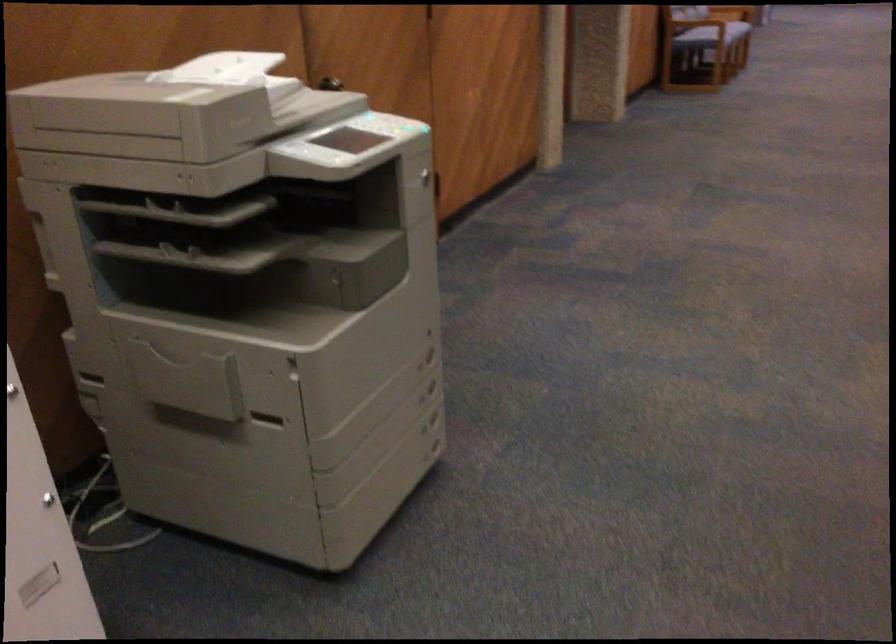
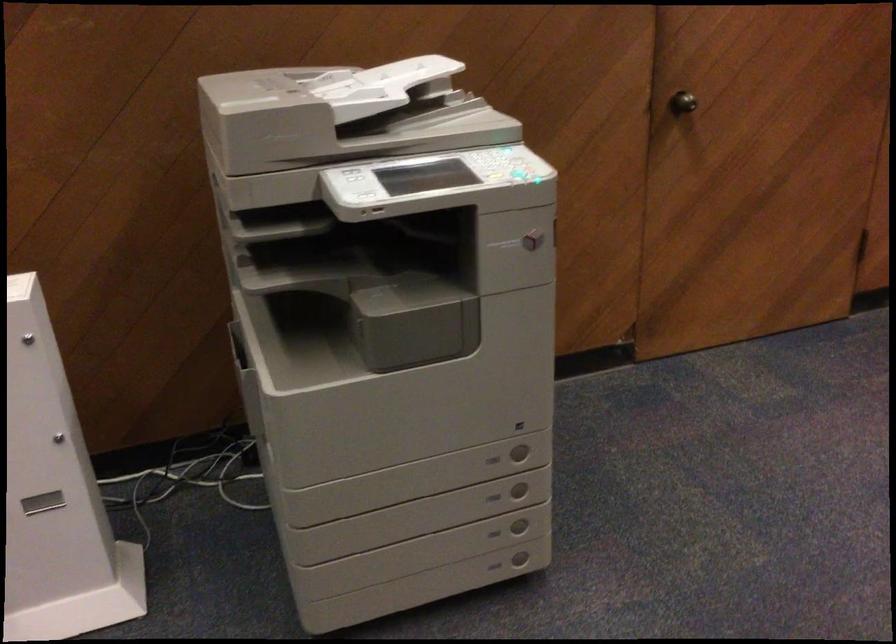
Find the pixel in the second image that matches the point at 435,392 in the first image.

(519, 489)